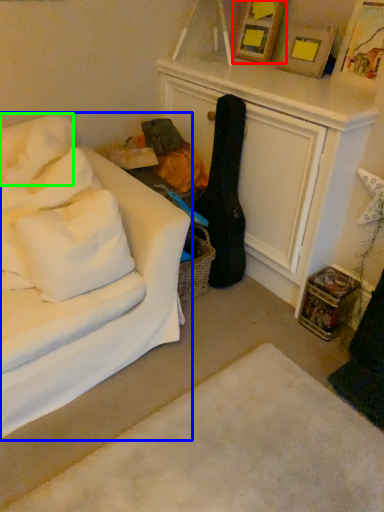
Question: Which object is the closest to the picture frame (highlighted by a red box)? Choose among these: studio couch (highlighted by a blue box) or pillow (highlighted by a green box).

Choices:
 (A) studio couch
 (B) pillow

Answer: (B)